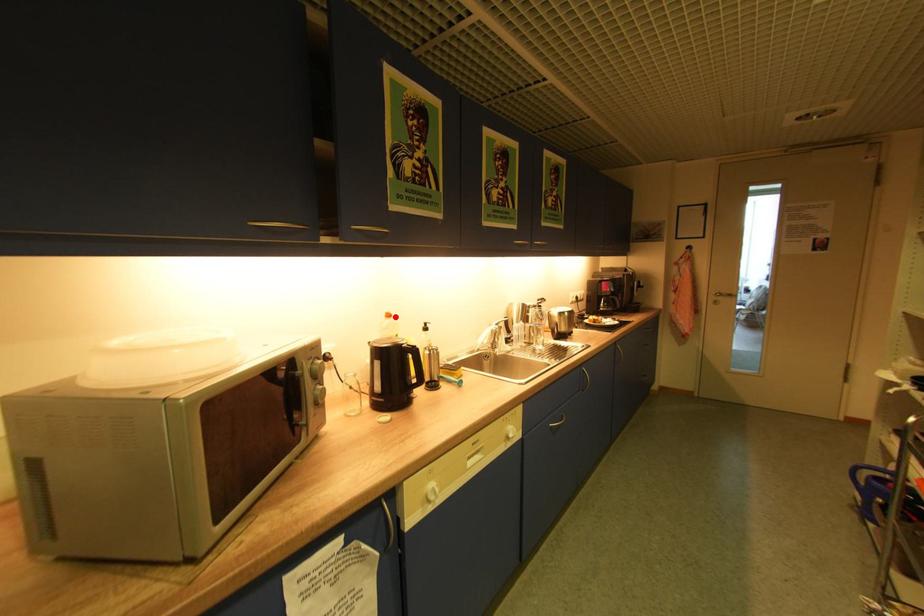
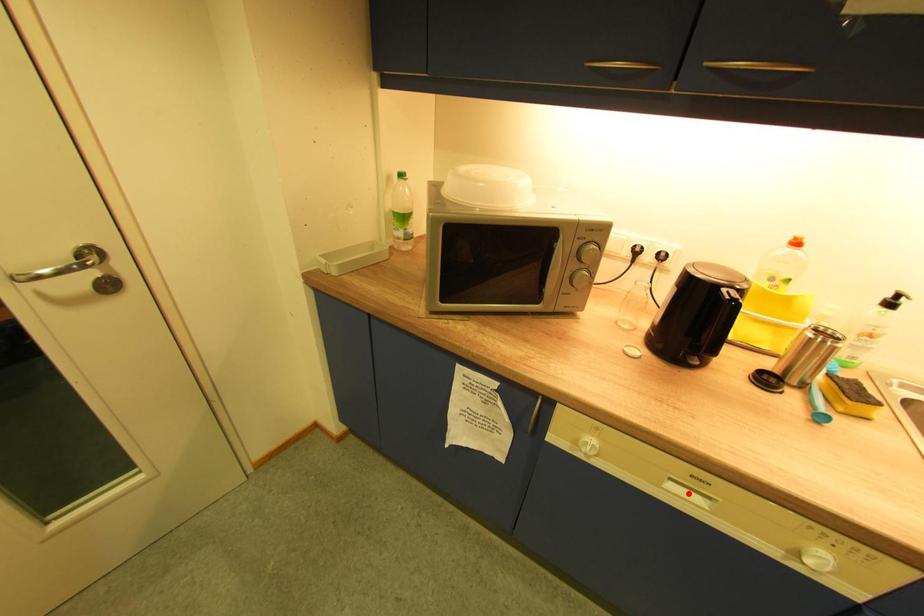
I am providing you with two images of the same scene from different viewpoints. A red point is marked on the first image and another point is marked on the second image. Is the marked point in image1 the same physical position as the marked point in image2?

No